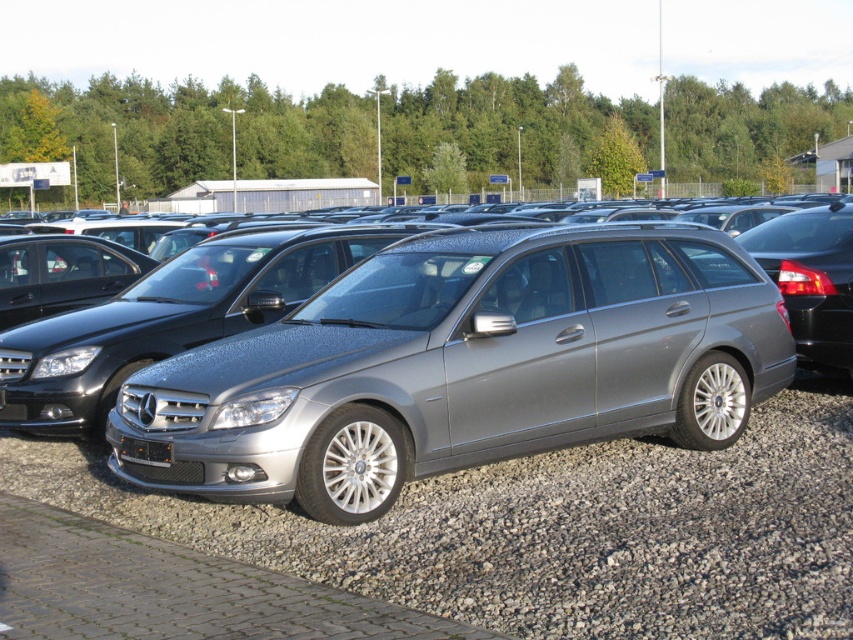
Question: Does satin metallic station wagon at center have a greater width compared to gray gravel at center?

Choices:
 (A) yes
 (B) no

Answer: (A)

Question: Which object appears closest to the camera in this image?

Choices:
 (A) satin metallic station wagon at center
 (B) gray gravel at center

Answer: (B)

Question: Which point is farther to the camera?

Choices:
 (A) satin metallic station wagon at center
 (B) gray gravel at center

Answer: (A)

Question: Is satin metallic station wagon at center closer to camera compared to gray gravel at center?

Choices:
 (A) yes
 (B) no

Answer: (B)

Question: Does satin metallic station wagon at center appear over gray gravel at center?

Choices:
 (A) no
 (B) yes

Answer: (B)